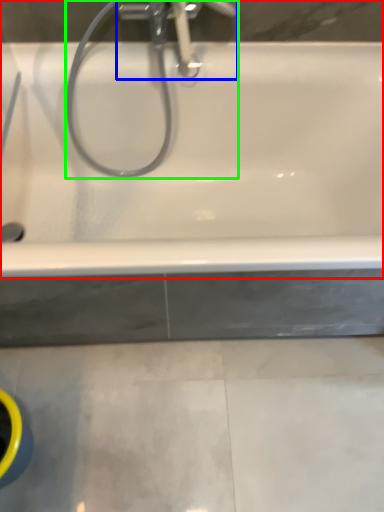
Question: Estimate the real-world distances between objects in this image. Which object is farther from bathtub (highlighted by a red box), tap (highlighted by a blue box) or plumbing fixture (highlighted by a green box)?

Choices:
 (A) tap
 (B) plumbing fixture

Answer: (A)